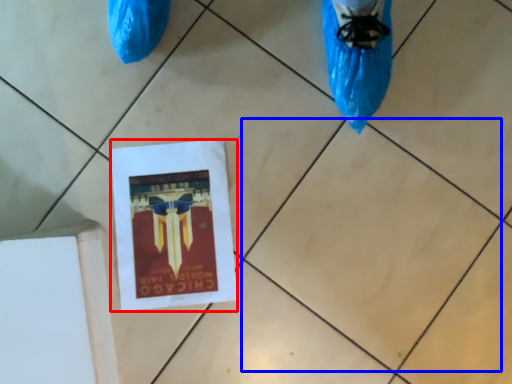
Question: Which of the following is the farthest to the observer, flyer (highlighted by a red box) or tile (highlighted by a blue box)?

Choices:
 (A) flyer
 (B) tile

Answer: (A)